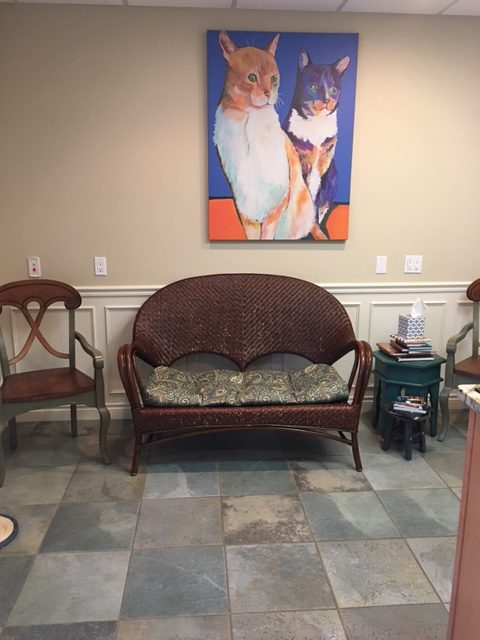
In order to click on books in this screenshot , I will do `click(421, 352)`.